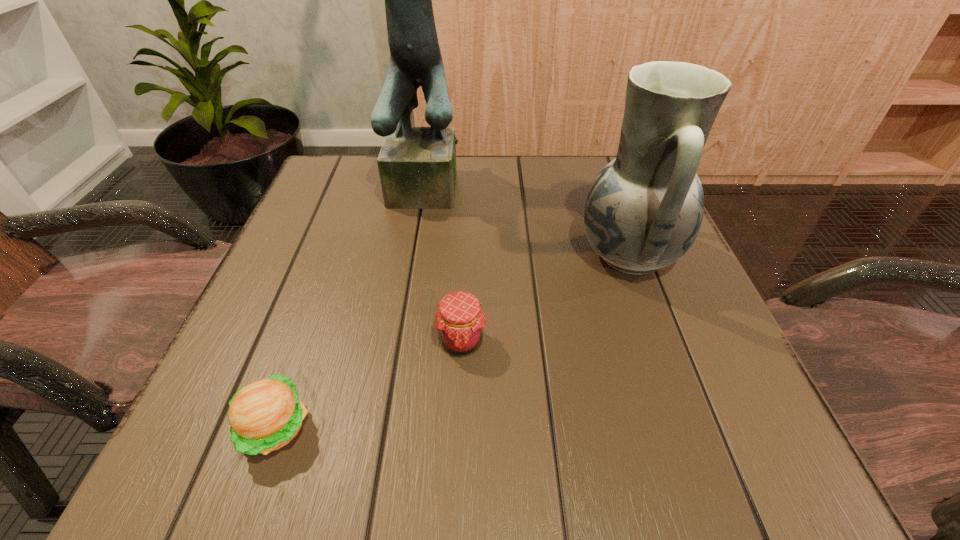
Where is `sculpture`? The height and width of the screenshot is (540, 960). sculpture is located at coordinates [417, 167].

Identify the location of the farthest object. Image resolution: width=960 pixels, height=540 pixels. (417, 167).

The height and width of the screenshot is (540, 960). Identify the location of the second tallest object. (644, 210).

This screenshot has width=960, height=540. What are the coordinates of `pitcher` in the screenshot? It's located at (644, 210).

This screenshot has height=540, width=960. Identify the location of jam. (460, 322).

The width and height of the screenshot is (960, 540). What are the coordinates of `hamburger` in the screenshot? It's located at (264, 416).

Find the location of a particular element. This screenshot has height=540, width=960. the nearest object is located at coordinates (264, 416).

Locate an element on the screen. vacant space located 0.190m on the face of the tallest object is located at coordinates (420, 273).

Where is `vacant region located on the front-facing side of the second farthest object`? This screenshot has width=960, height=540. vacant region located on the front-facing side of the second farthest object is located at coordinates (414, 254).

Locate an element on the screen. Image resolution: width=960 pixels, height=540 pixels. blank space located on the front-facing side of the second farthest object is located at coordinates (441, 254).